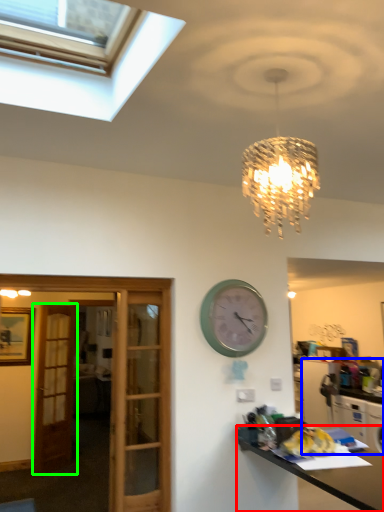
Question: Based on their relative distances, which object is nearer to desk (highlighted by a red box)? Choose from cabinetry (highlighted by a blue box) and door (highlighted by a green box).

Choices:
 (A) cabinetry
 (B) door

Answer: (B)